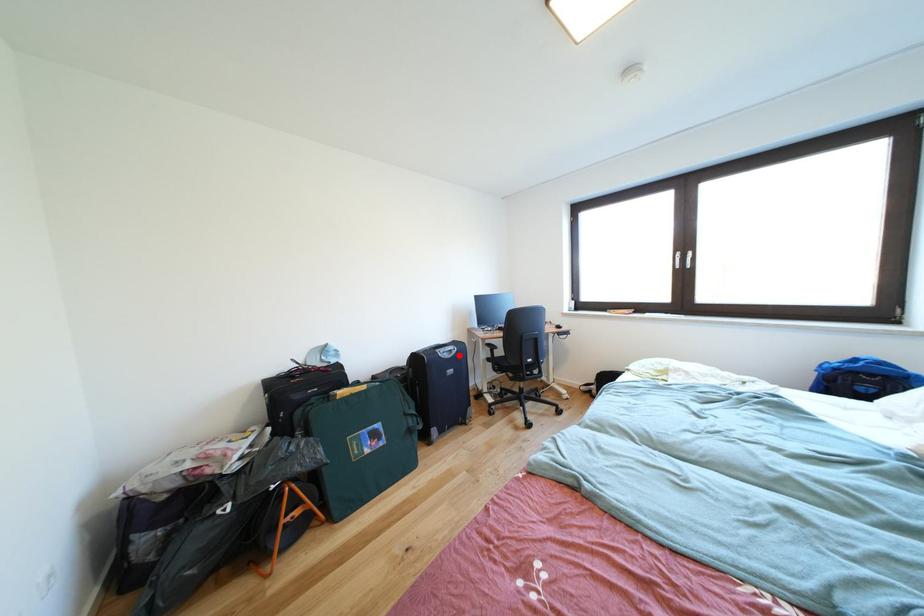
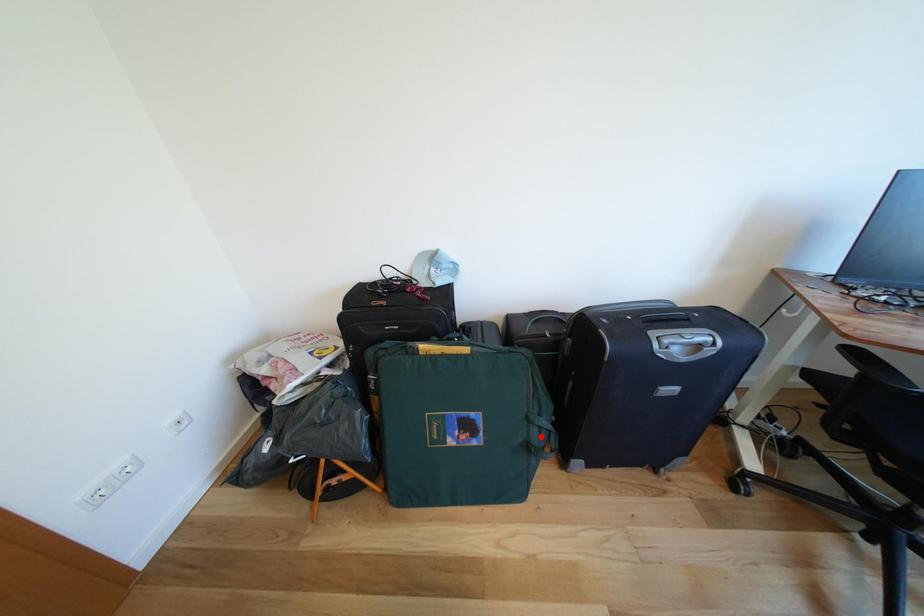
I am providing you with two images of the same scene from different viewpoints. A red point is marked on the first image and another point is marked on the second image. Do the highlighted points in image1 and image2 indicate the same real-world spot?

No